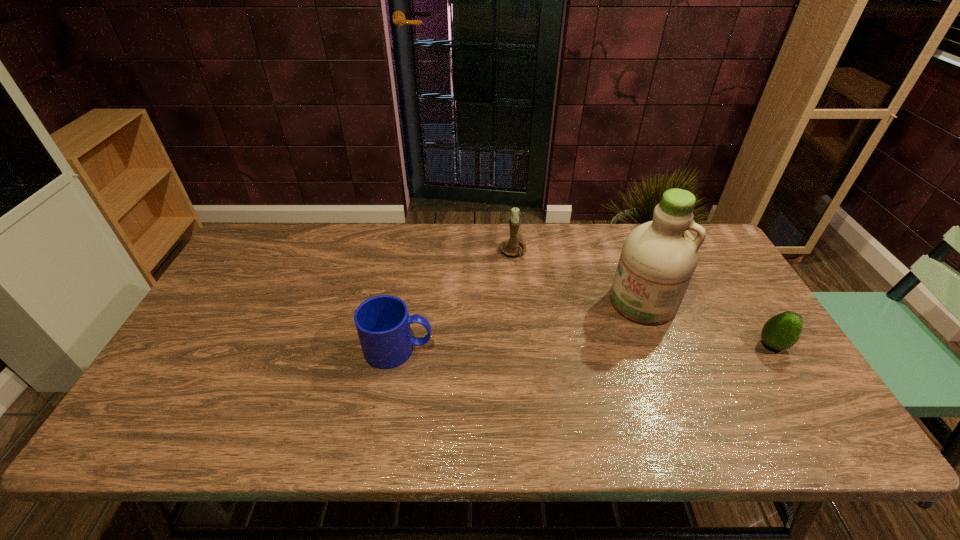
The width and height of the screenshot is (960, 540). Identify the location of free space that is in between the leftmost object and the second farthest object. coord(521,326).

Locate an element on the screen. vacant region between the rightmost object and the cleansing agent is located at coordinates (708, 323).

Identify the location of free spot between the rightmost object and the mug. The image size is (960, 540). (586, 347).

Identify the location of unoccupied position between the leftmost object and the avocado. The height and width of the screenshot is (540, 960). (586, 347).

This screenshot has height=540, width=960. Find the location of `vacant space that is in between the third nearest object and the rightmost object`. vacant space that is in between the third nearest object and the rightmost object is located at coordinates (708, 323).

Locate an element on the screen. This screenshot has width=960, height=540. free point between the mug and the third nearest object is located at coordinates (521, 326).

Find the location of `free space between the candle holder and the tallest object`. free space between the candle holder and the tallest object is located at coordinates (578, 277).

The width and height of the screenshot is (960, 540). I want to click on vacant point located between the tallest object and the leftmost object, so click(x=521, y=326).

Point out which object is positioned as the third nearest to the mug. Please provide its 2D coordinates. Your answer should be formatted as a tuple, i.e. [(x, y)], where the tuple contains the x and y coordinates of a point satisfying the conditions above.

[(782, 331)]

Where is `object that is the closest to the mug`? object that is the closest to the mug is located at coordinates (511, 247).